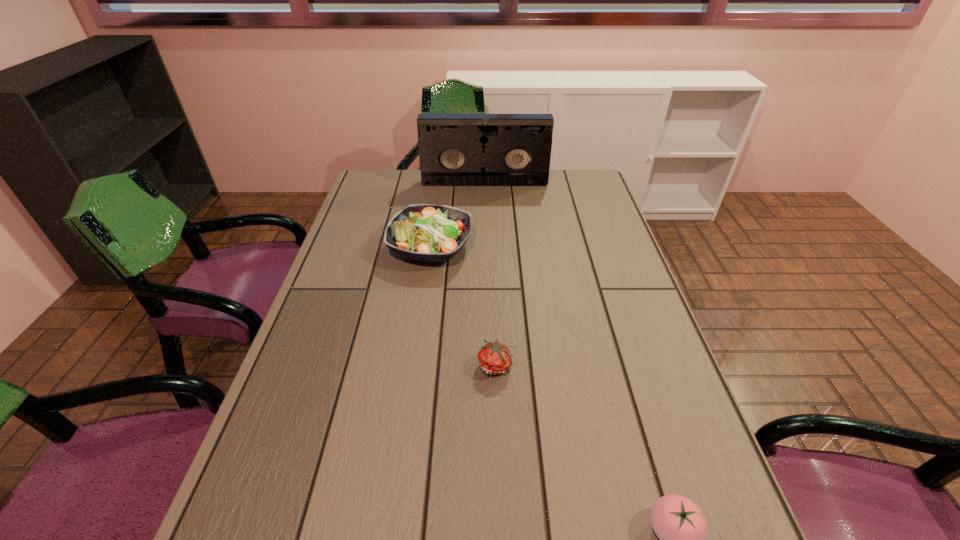
Where is `the tallest object`? the tallest object is located at coordinates (454, 149).

Identify the location of videotape. (454, 149).

The image size is (960, 540). Find the location of `the third nearest object`. the third nearest object is located at coordinates (425, 232).

Identify the location of salad plate. (425, 232).

The width and height of the screenshot is (960, 540). I want to click on the third farthest object, so click(x=494, y=357).

At what (x,y) coordinates should I click in order to perform the action: click on the shortest object. Please return your answer as a coordinate pair (x, y). The width and height of the screenshot is (960, 540). Looking at the image, I should click on (494, 357).

At what (x,y) coordinates should I click in order to perform the action: click on vacant space located 0.190m on the front side of the tallest object. Please return your answer as a coordinate pair (x, y). This screenshot has width=960, height=540. Looking at the image, I should click on (485, 215).

The image size is (960, 540). In order to click on free region located on the back of the third nearest object in this screenshot , I will do `click(440, 184)`.

The height and width of the screenshot is (540, 960). In order to click on vacant area situated 0.230m on the front of the shorter tomato in this screenshot , I will do `click(500, 489)`.

Where is `object that is at the far edge`? Image resolution: width=960 pixels, height=540 pixels. object that is at the far edge is located at coordinates (454, 149).